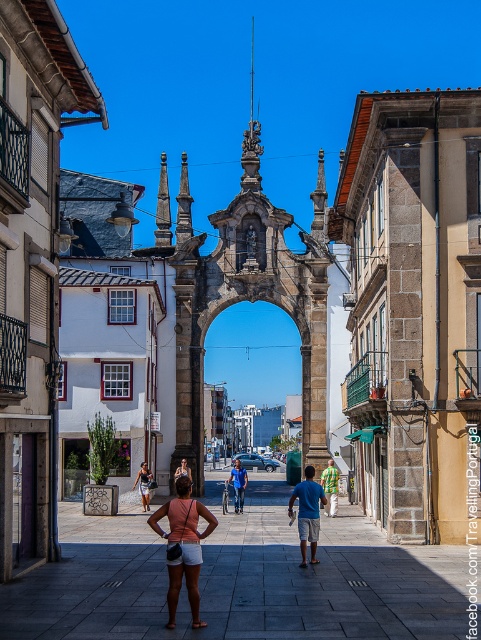
You are a tourist standing in front of the historic stone archway. You see the smooth stone alley at center and the green plaid shirt at center. Which object is closer to you?

The smooth stone alley at center is closer to you because it is in front of the green plaid shirt at center.

Based on the photo, you are a tourist standing at the base of the historic stone archway. You see a smooth stone alley at center and orange matte shorts at center. You want to take a photo of both objects in the same frame. Can you do it without moving your camera position?

The smooth stone alley at center and orange matte shorts at center are 12.43 meters apart. Since they are relatively close to each other, you can likely capture both in the same frame without moving your camera position.